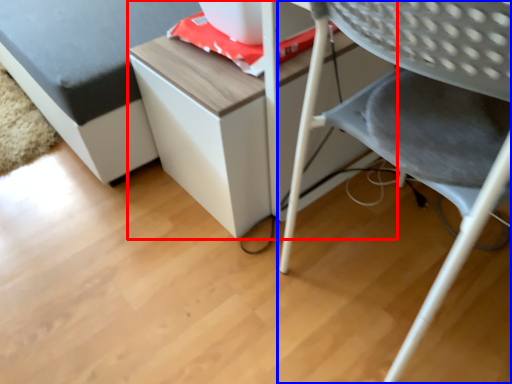
Question: Which object is further to the camera taking this photo, table (highlighted by a red box) or chair (highlighted by a blue box)?

Choices:
 (A) table
 (B) chair

Answer: (A)